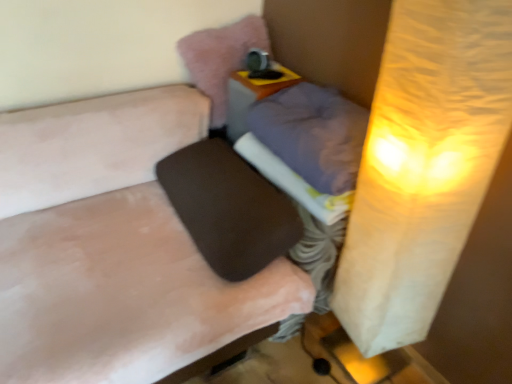
The height and width of the screenshot is (384, 512). What are the coordinates of `vacant area located to the right-hand side of metallic silver table lamp at upper center` in the screenshot? It's located at (281, 72).